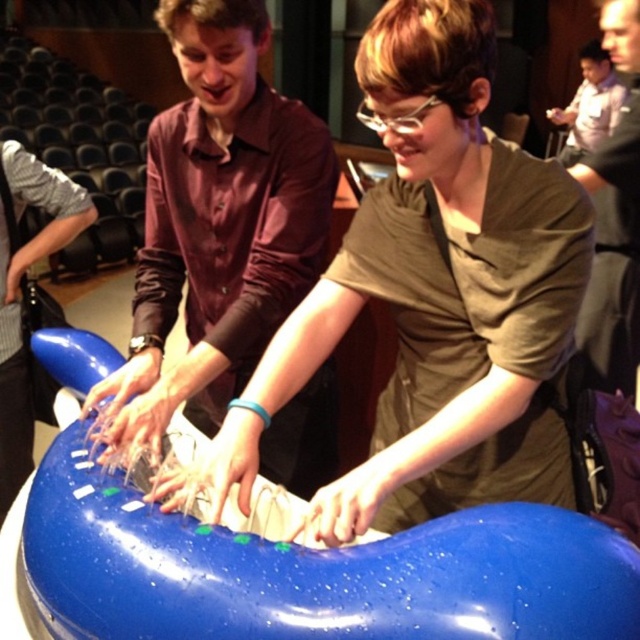
Image resolution: width=640 pixels, height=640 pixels. Describe the element at coordinates (614, 221) in the screenshot. I see `matte black shirt at upper right` at that location.

Who is shorter, matte black shirt at upper right or light blue plastic toy at upper right?

light blue plastic toy at upper right is shorter.

Which is behind, point (593, 376) or point (592, 86)?

Positioned behind is point (592, 86).

Where is `matte black shirt at upper right`? This screenshot has width=640, height=640. matte black shirt at upper right is located at coordinates (614, 221).

Can you confirm if matte brown shirt at center is smaller than light blue plastic toy at upper right?

Yes.

Measure the distance between matte brown shirt at center and camera.

matte brown shirt at center and camera are 1.00 meters apart.

Is point (211, 312) farther from viewer compared to point (586, 86)?

That is False.

Locate an element on the screen. matte brown shirt at center is located at coordinates (218, 224).

In the scene shown: Does glossy plastic object at center have a smaller size compared to matte brown shirt at center?

Indeed, glossy plastic object at center has a smaller size compared to matte brown shirt at center.

Can you confirm if glossy plastic object at center is positioned to the left of matte brown shirt at center?

No, glossy plastic object at center is not to the left of matte brown shirt at center.

This screenshot has height=640, width=640. Identify the location of glossy plastic object at center. (433, 298).